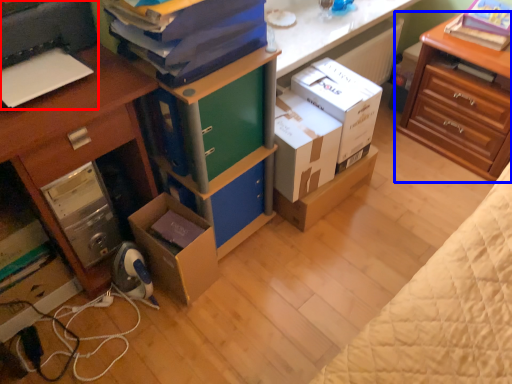
Question: Among these objects, which one is farthest to the camera, printer (highlighted by a red box) or nightstand (highlighted by a blue box)?

Choices:
 (A) printer
 (B) nightstand

Answer: (B)